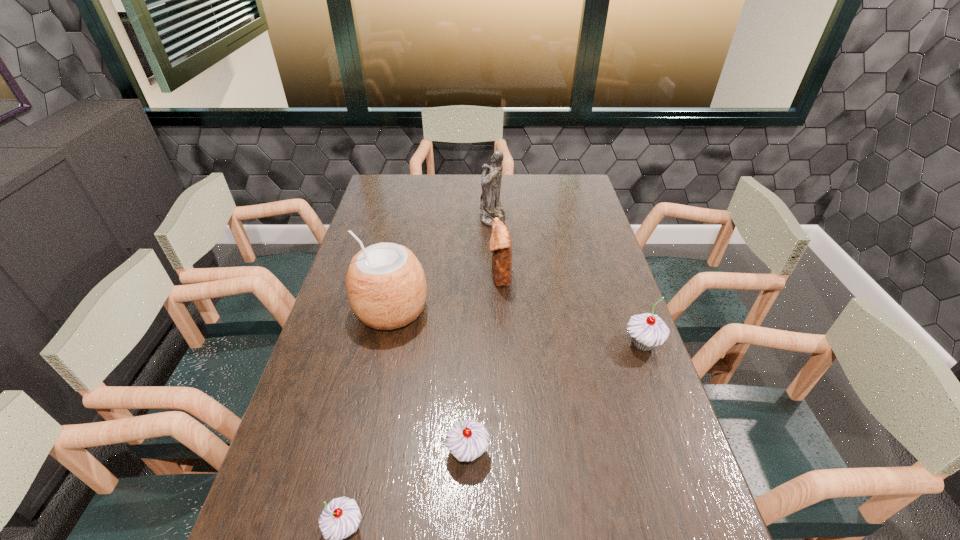
Find the location of a particular element. This screenshot has height=540, width=960. location for an additional cupcake to make spacing equal is located at coordinates (564, 392).